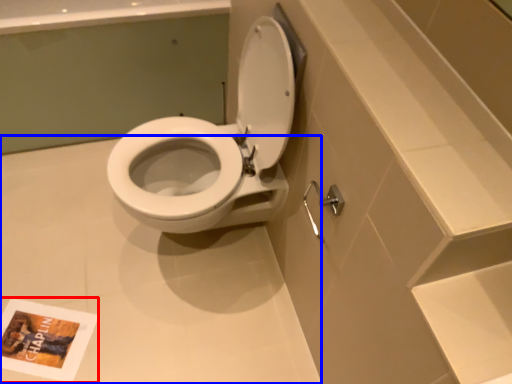
Question: Which point is closer to the camera, book cover (highlighted by a red box) or plain (highlighted by a blue box)?

Choices:
 (A) book cover
 (B) plain

Answer: (B)